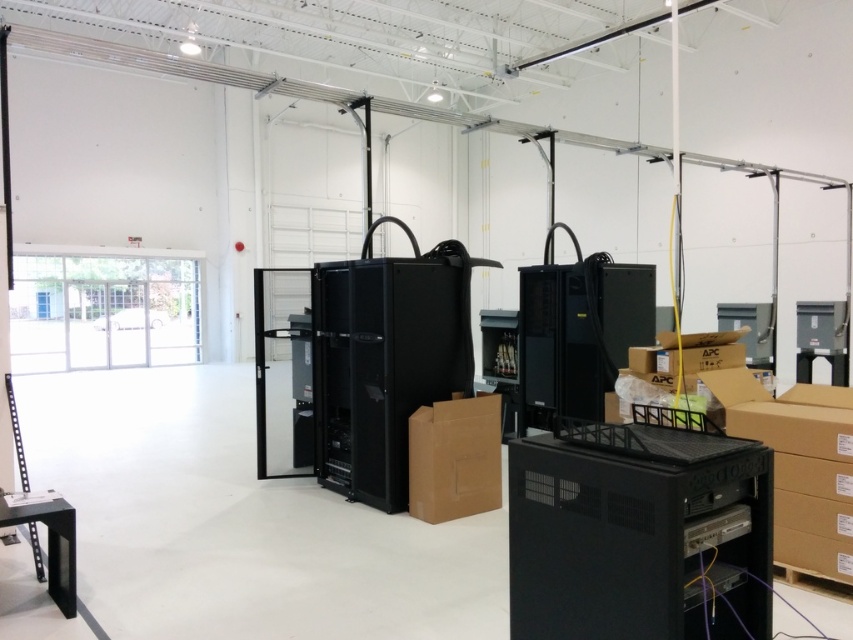
Question: Which object is farther from the camera taking this photo?

Choices:
 (A) brown cardboard box at center
 (B) black matte server at center

Answer: (B)

Question: Estimate the real-world distances between objects in this image. Which object is closer to the black plastic server at center?

Choices:
 (A) brown cardboard box at center
 (B) black matte server at center

Answer: (A)

Question: Which object is closer to the camera taking this photo?

Choices:
 (A) black matte server at center
 (B) brown cardboard box at center

Answer: (B)

Question: Can you confirm if black matte server at center is positioned above brown cardboard box at center?

Choices:
 (A) no
 (B) yes

Answer: (B)

Question: Can you confirm if black plastic server at center is positioned below brown cardboard box at center?

Choices:
 (A) no
 (B) yes

Answer: (A)

Question: Observing the image, what is the correct spatial positioning of black plastic server at center in reference to black matte server at center?

Choices:
 (A) right
 (B) left

Answer: (B)